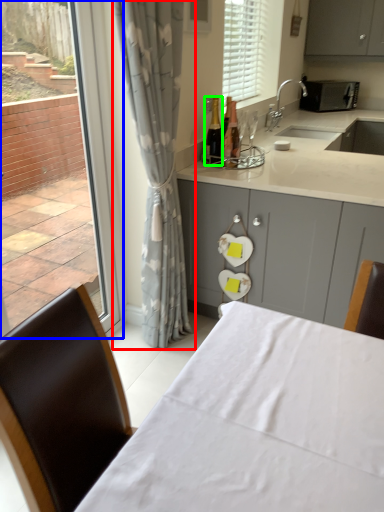
Question: Considering the real-world distances, which object is farthest from curtain (highlighted by a red box)? window (highlighted by a blue box) or bottle (highlighted by a green box)?

Choices:
 (A) window
 (B) bottle

Answer: (B)